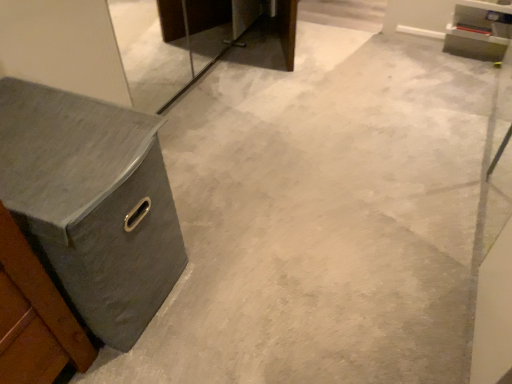
Question: In the image, is matte gray cabinet at upper right on the left side or the right side of gray fabric chest of drawers at left?

Choices:
 (A) left
 (B) right

Answer: (B)

Question: Looking at their shapes, would you say matte gray cabinet at upper right is wider or thinner than gray fabric chest of drawers at left?

Choices:
 (A) thin
 (B) wide

Answer: (A)

Question: Considering the positions of point (465, 36) and point (146, 162), is point (465, 36) closer or farther from the camera than point (146, 162)?

Choices:
 (A) closer
 (B) farther

Answer: (B)

Question: Is gray fabric chest of drawers at left inside or outside of matte gray cabinet at upper right?

Choices:
 (A) outside
 (B) inside

Answer: (A)

Question: In terms of width, does gray fabric chest of drawers at left look wider or thinner when compared to matte gray cabinet at upper right?

Choices:
 (A) thin
 (B) wide

Answer: (B)

Question: Is point click(x=24, y=125) closer or farther from the camera than point click(x=494, y=29)?

Choices:
 (A) farther
 (B) closer

Answer: (B)

Question: From a real-world perspective, is gray fabric chest of drawers at left above or below matte gray cabinet at upper right?

Choices:
 (A) above
 (B) below

Answer: (A)